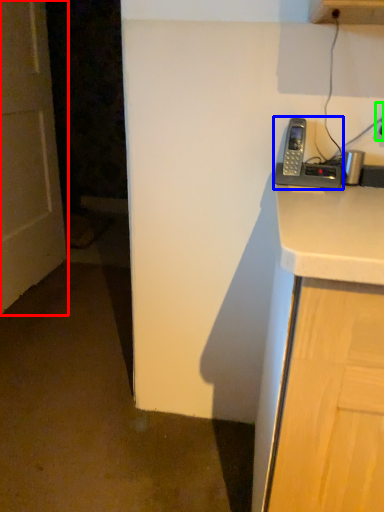
Question: Estimate the real-world distances between objects in this image. Which object is farther from door (highlighted by a red box), corded phone (highlighted by a blue box) or electric outlet (highlighted by a green box)?

Choices:
 (A) corded phone
 (B) electric outlet

Answer: (B)